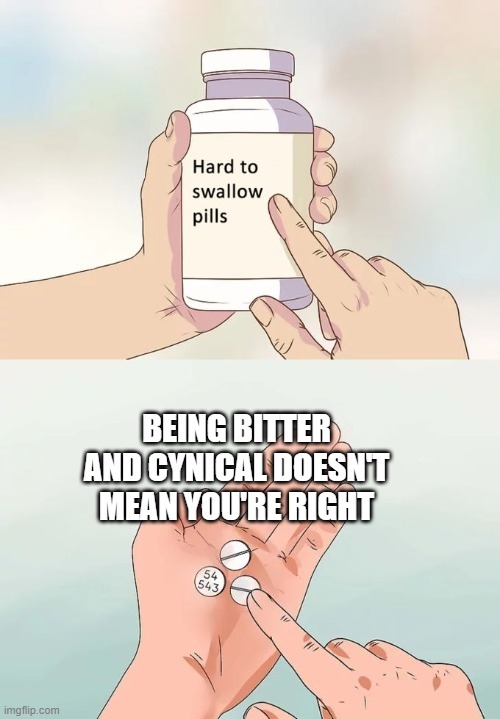
You are a GUI agent. You are given a task and a screenshot of the screen. Output one action in this format:
    pyautogui.click(x=<x>, y=<y>)
    Task: Click on the bottle
    The width and height of the screenshot is (500, 719).
    Given the screenshot: What is the action you would take?
    pyautogui.click(x=218, y=301)